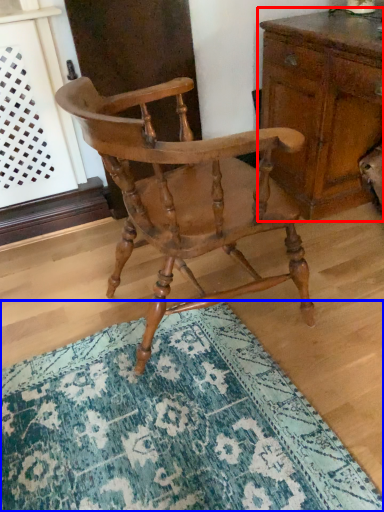
Question: Which object is closer to the camera taking this photo, chest of drawers (highlighted by a red box) or doormat (highlighted by a blue box)?

Choices:
 (A) chest of drawers
 (B) doormat

Answer: (B)